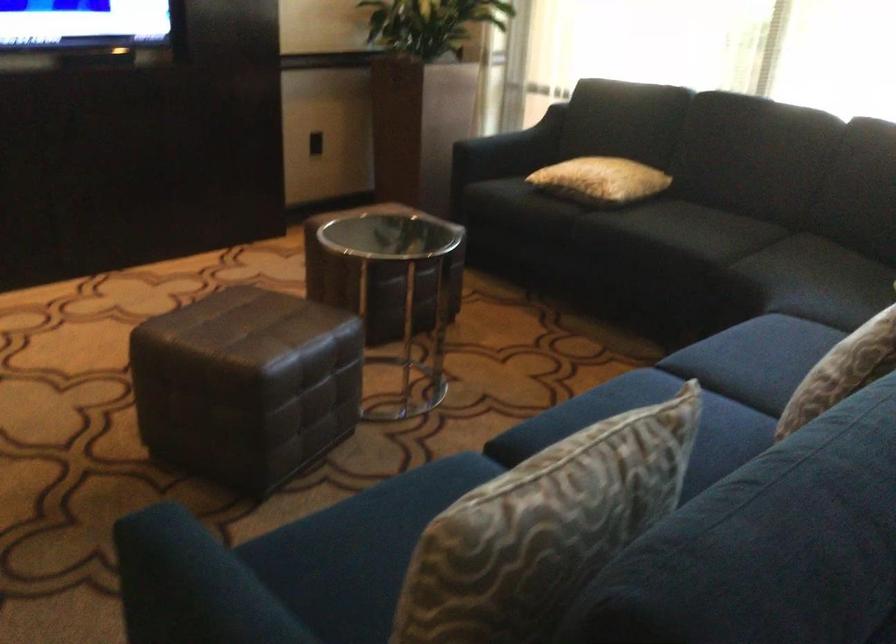
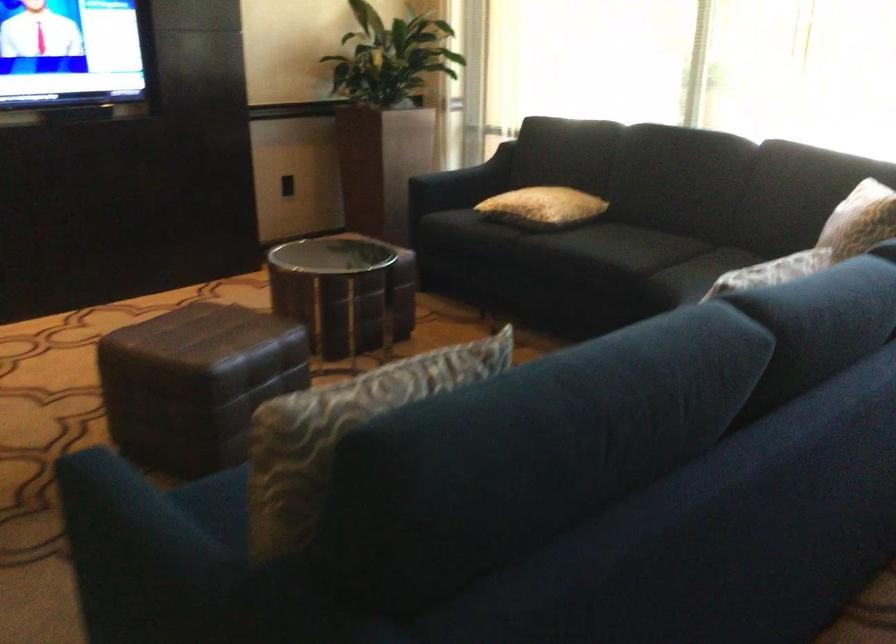
Where in the second image is the point corresponding to [507,149] from the first image?

(460, 184)